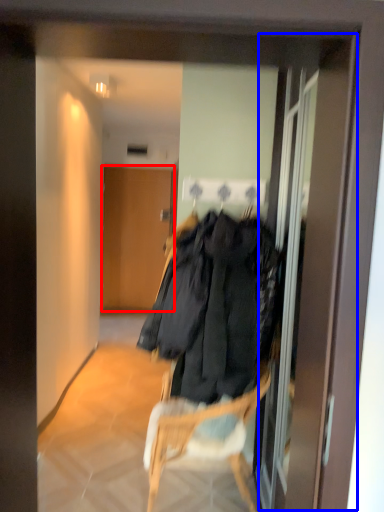
Question: Which of the following is the closest to the observer, door (highlighted by a red box) or screen door (highlighted by a blue box)?

Choices:
 (A) door
 (B) screen door

Answer: (B)